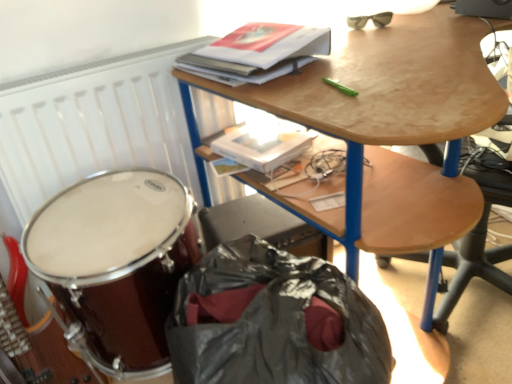
You are a GUI agent. You are given a task and a screenshot of the screen. Output one action in this format:
    pyautogui.click(x=<x>, y=<y>)
    Task: Click on the free location to the right of hardcover book at upper center
    This screenshot has width=512, height=384.
    Given the screenshot: What is the action you would take?
    pyautogui.click(x=374, y=50)